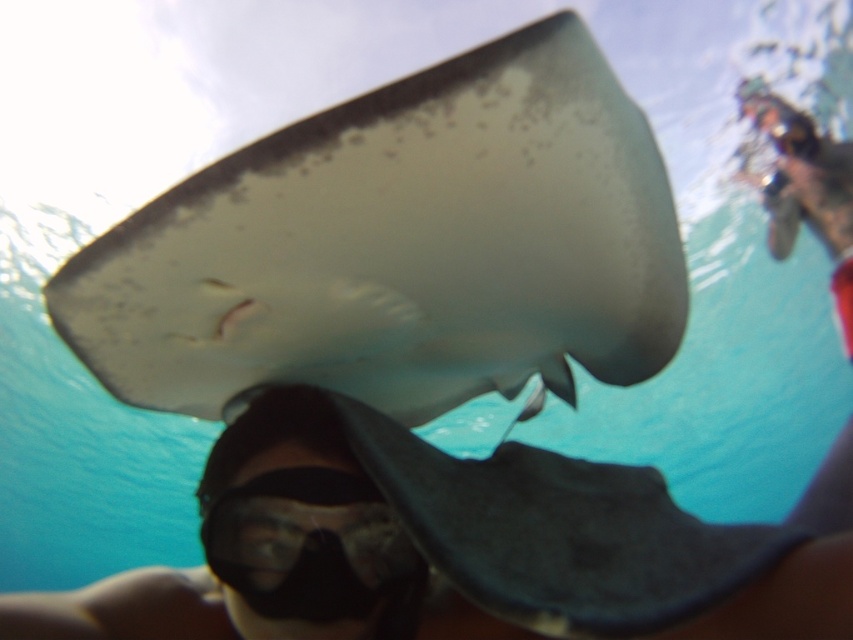
Question: Considering the relative positions of smooth white stingray at center and black matte goggles at lower center in the image provided, where is smooth white stingray at center located with respect to black matte goggles at lower center?

Choices:
 (A) right
 (B) left

Answer: (A)

Question: Which object appears closest to the camera in this image?

Choices:
 (A) smooth white stingray at center
 (B) black matte goggles at lower center

Answer: (A)

Question: Which point is closer to the camera?

Choices:
 (A) (416, 561)
 (B) (125, 225)

Answer: (B)

Question: Does smooth white stingray at center appear under black matte goggles at lower center?

Choices:
 (A) yes
 (B) no

Answer: (B)

Question: Is smooth white stingray at center closer to the viewer compared to black matte goggles at lower center?

Choices:
 (A) yes
 (B) no

Answer: (A)